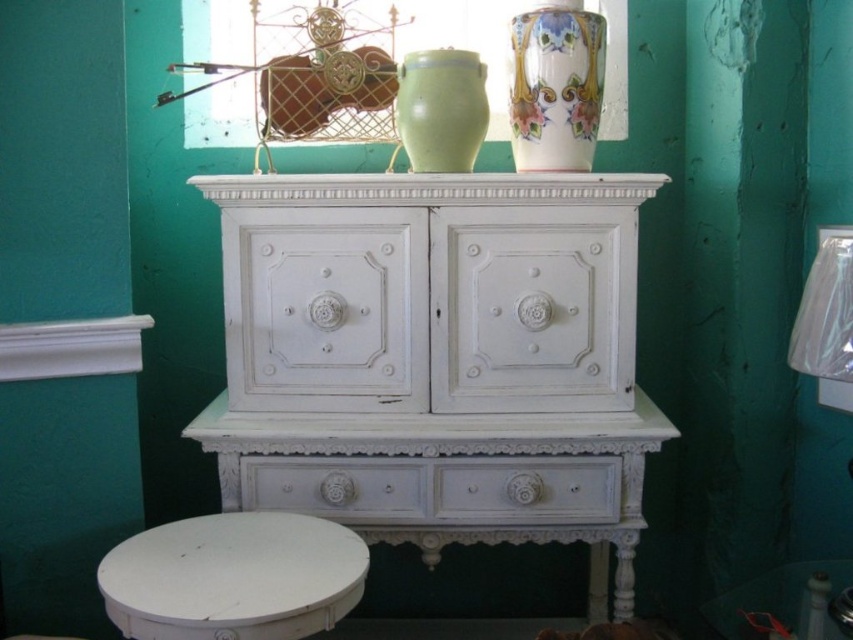
Question: Which point is farther to the camera?

Choices:
 (A) (138, 568)
 (B) (602, 508)
 (C) (566, 38)
 (D) (283, 486)

Answer: (C)

Question: Is white painted wood table at lower center smaller than porcelain vase at upper right?

Choices:
 (A) yes
 (B) no

Answer: (B)

Question: Which is nearer to the white distressed wood dresser at center?

Choices:
 (A) porcelain vase at upper right
 (B) matte glass window at upper center
 (C) matte ceramic vase at upper center

Answer: (C)

Question: Is matte glass window at upper center to the left of porcelain vase at upper right from the viewer's perspective?

Choices:
 (A) yes
 (B) no

Answer: (A)

Question: Does matte glass window at upper center appear on the left side of porcelain vase at upper right?

Choices:
 (A) no
 (B) yes

Answer: (B)

Question: Which point is farther to the camera?

Choices:
 (A) matte glass window at upper center
 (B) porcelain vase at upper right
 (C) white carved wood drawer at center
 (D) white distressed wood dresser at center

Answer: (A)